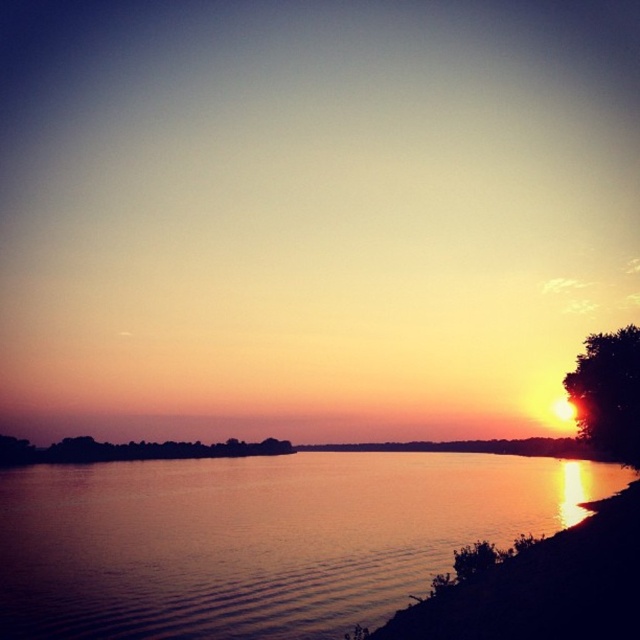
Question: Is silky water at center to the right of silvery metallic tree at right from the viewer's perspective?

Choices:
 (A) no
 (B) yes

Answer: (A)

Question: Based on their relative distances, which object is nearer to the silvery metallic tree at right?

Choices:
 (A) green leafy tree at lower left
 (B) silky water at center

Answer: (B)

Question: Which object is closer to the camera taking this photo?

Choices:
 (A) green leafy tree at lower left
 (B) silvery metallic tree at right

Answer: (B)

Question: Among these objects, which one is farthest from the camera?

Choices:
 (A) silvery metallic tree at right
 (B) silky water at center

Answer: (A)

Question: In this image, where is silky water at center located relative to green leafy tree at lower left?

Choices:
 (A) above
 (B) below

Answer: (A)

Question: Considering the relative positions of silvery metallic tree at right and green leafy tree at lower left in the image provided, where is silvery metallic tree at right located with respect to green leafy tree at lower left?

Choices:
 (A) above
 (B) below

Answer: (A)